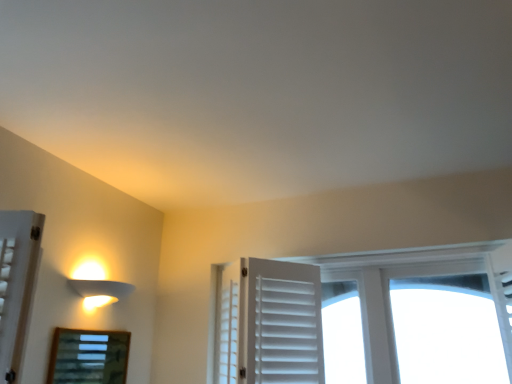
Question: Does point (112, 360) appear closer or farther from the camera than point (84, 294)?

Choices:
 (A) closer
 (B) farther

Answer: (B)

Question: In terms of height, does wooden framed mirror at lower left look taller or shorter compared to matte white lamp at left?

Choices:
 (A) short
 (B) tall

Answer: (B)

Question: Based on their positions, is wooden framed mirror at lower left located to the left or right of matte white lamp at left?

Choices:
 (A) right
 (B) left

Answer: (B)

Question: Is matte white lamp at left taller or shorter than wooden framed mirror at lower left?

Choices:
 (A) short
 (B) tall

Answer: (A)

Question: Would you say matte white lamp at left is to the left or to the right of wooden framed mirror at lower left in the picture?

Choices:
 (A) right
 (B) left

Answer: (A)

Question: From a real-world perspective, is matte white lamp at left above or below wooden framed mirror at lower left?

Choices:
 (A) below
 (B) above

Answer: (B)

Question: Is point (80, 283) positioned closer to the camera than point (74, 372)?

Choices:
 (A) farther
 (B) closer

Answer: (A)